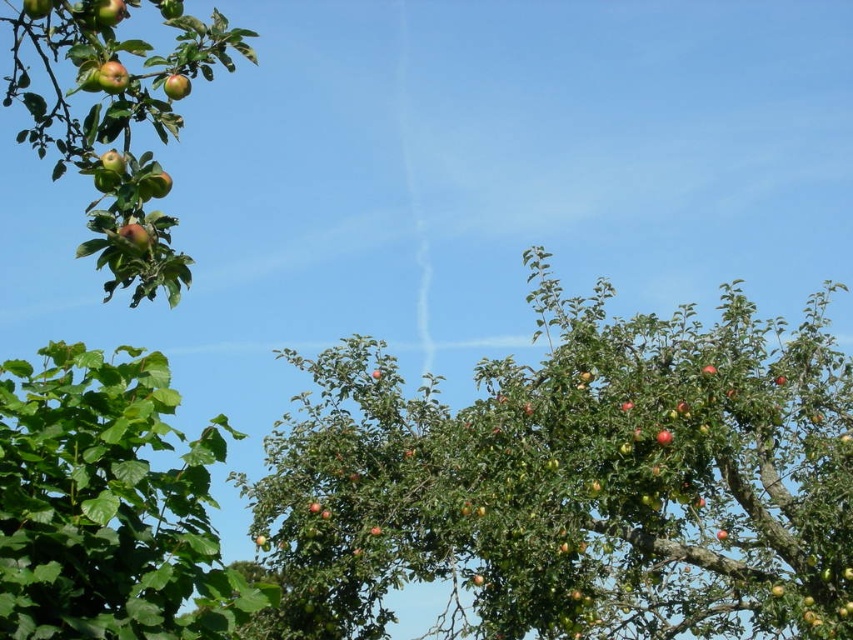
Who is positioned more to the left, shiny green apples at upper left or shiny red apple at upper left?

From the viewer's perspective, shiny green apples at upper left appears more on the left side.

Between shiny green apples at upper left and shiny red apple at upper left, which one has more height?

Standing taller between the two is shiny green apples at upper left.

Is point (35, 125) positioned behind point (115, 83)?

Yes, point (35, 125) is behind point (115, 83).

Find the location of a particular element. shiny green apples at upper left is located at coordinates (115, 124).

Based on the photo, is shiny red apple at upper left below glossy red apple at upper left?

No, shiny red apple at upper left is not below glossy red apple at upper left.

Does shiny red apple at upper left have a larger size compared to glossy red apple at upper left?

Incorrect, shiny red apple at upper left is not larger than glossy red apple at upper left.

Which is behind, point (109, 61) or point (178, 74)?

Positioned behind is point (178, 74).

Locate an element on the screen. Image resolution: width=853 pixels, height=640 pixels. shiny red apple at upper left is located at coordinates (112, 76).

Does point (352, 532) lie in front of point (181, 595)?

No.

Which is more to the left, green matte tree at center or green leafy tree at left?

From the viewer's perspective, green leafy tree at left appears more on the left side.

Find the location of a particular element. This screenshot has height=640, width=853. green matte tree at center is located at coordinates (573, 481).